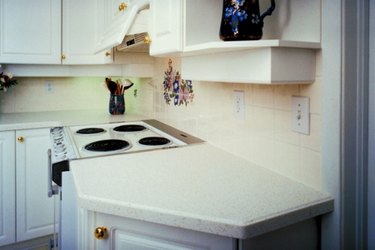
Locate an element on the screen. backsplash is located at coordinates pyautogui.click(x=185, y=113).